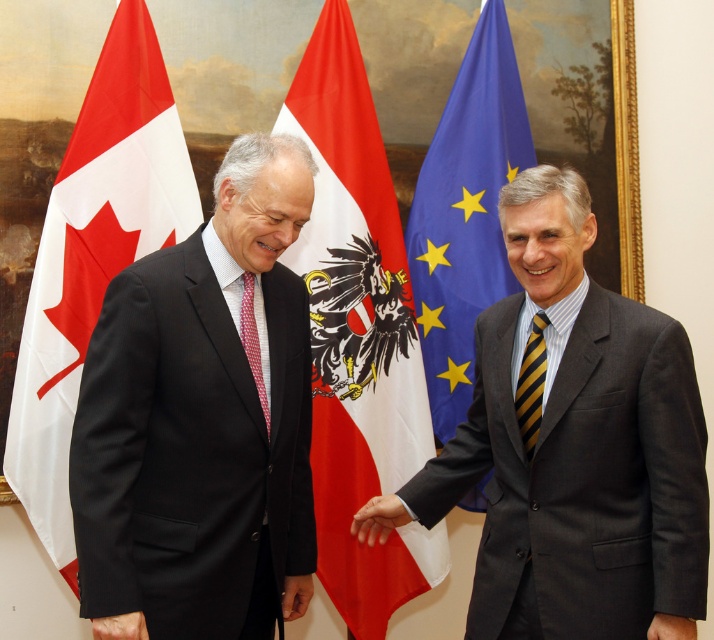
Consider the image. Where is the yellow striped tie at right located in the image?

The yellow striped tie at right is located at point (531, 385).

You are a photographer adjusting the camera settings to capture the handshake between the two men. You need to ensure that both the blue fabric flag at right and the matte black hand at lower left are in focus. Given that the camera can only focus on objects within a 1.5 meter width, will both objects fit within this focus range?

The blue fabric flag at right is wider than the matte black hand at lower left. Since the camera can focus on objects within a 1.5 meter width, and the total width required would depend on their combined or individual dimensions, but the description only states the flag is wider than the hand. However, without specific measurements, we cannot definitively confirm if both fit within the 1.5 meter range. Additional information about their exact widths is needed.